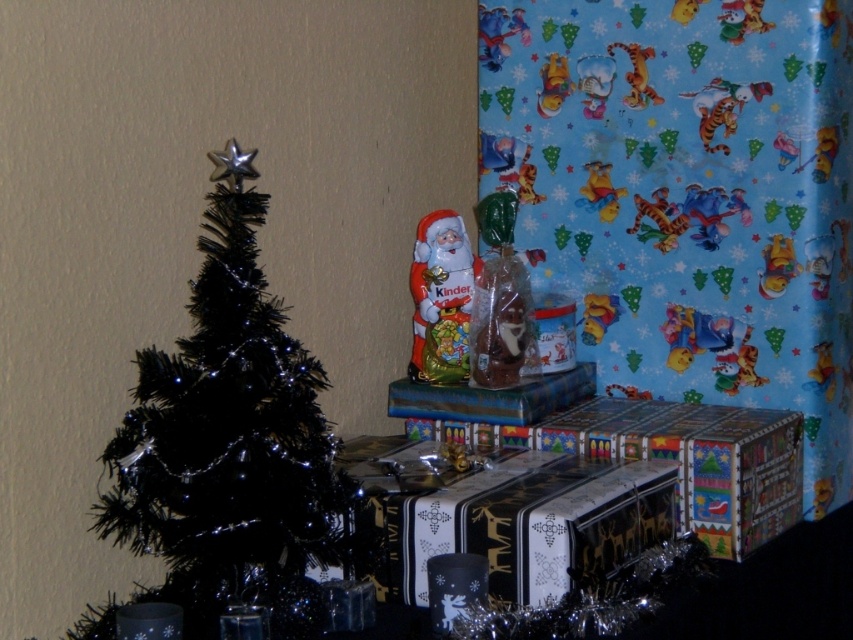
Question: Where is metallic silver gift at center located in relation to matte yellow plush bear at upper center in the image?

Choices:
 (A) below
 (B) above

Answer: (A)

Question: Can you confirm if metallic silver gift at center is smaller than matte plastic santa at center?

Choices:
 (A) yes
 (B) no

Answer: (B)

Question: Among these points, which one is nearest to the camera?

Choices:
 (A) (440, 515)
 (B) (428, 305)
 (C) (612, 435)

Answer: (A)

Question: Based on their relative distances, which object is nearer to the metallic silver gift at center?

Choices:
 (A) black artificial tree at left
 (B) black matte gift at center
 (C) matte yellow plush bear at upper center

Answer: (B)

Question: Is metallic silver gift at center above matte plastic santa at center?

Choices:
 (A) no
 (B) yes

Answer: (A)

Question: Which point is closer to the camera?

Choices:
 (A) matte yellow plush bear at upper center
 (B) matte plastic santa at center
 (C) metallic silver gift at center

Answer: (C)